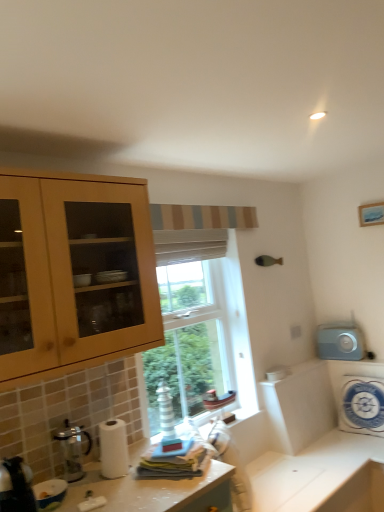
Question: Considering the relative positions of metallic silver kettle at lower left, placed as the 1th appliance when sorted from left to right, and gray matte clock at right, arranged as the third appliance when viewed from the left, in the image provided, is metallic silver kettle at lower left, placed as the 1th appliance when sorted from left to right, to the left of gray matte clock at right, arranged as the third appliance when viewed from the left, from the viewer's perspective?

Choices:
 (A) yes
 (B) no

Answer: (A)

Question: Are metallic silver kettle at lower left, placed as the 1th appliance when sorted from left to right, and gray matte clock at right, arranged as the third appliance when viewed from the left, located far from each other?

Choices:
 (A) no
 (B) yes

Answer: (B)

Question: Is metallic silver kettle at lower left, placed as the 1th appliance when sorted from left to right, shorter than gray matte clock at right, arranged as the third appliance when viewed from the left?

Choices:
 (A) yes
 (B) no

Answer: (A)

Question: Does metallic silver kettle at lower left, which ranks as the 4th appliance in back-to-front order, have a greater width compared to gray matte clock at right, arranged as the 2th appliance when viewed from the right?

Choices:
 (A) yes
 (B) no

Answer: (A)

Question: Does metallic silver kettle at lower left, which is the 4th appliance from right to left, lie behind gray matte clock at right, arranged as the 4th appliance when viewed from the front?

Choices:
 (A) yes
 (B) no

Answer: (B)

Question: Choose the correct answer: Is white glossy bowl at lower left, the 2th appliance from the left, inside white glossy countertop at lower center or outside it?

Choices:
 (A) inside
 (B) outside

Answer: (B)

Question: Considering the relative positions of white glossy bowl at lower left, the 2th appliance from the left, and white glossy countertop at lower center in the image provided, is white glossy bowl at lower left, the 2th appliance from the left, to the left or to the right of white glossy countertop at lower center?

Choices:
 (A) left
 (B) right

Answer: (A)

Question: Looking at their shapes, would you say white glossy bowl at lower left, which is counted as the second appliance, starting from the front, is wider or thinner than white glossy countertop at lower center?

Choices:
 (A) wide
 (B) thin

Answer: (B)

Question: From the image's perspective, is white glossy bowl at lower left, which is counted as the second appliance, starting from the front, above or below white glossy countertop at lower center?

Choices:
 (A) above
 (B) below

Answer: (A)

Question: Looking at the image, does metallic silver coffee maker at lower left seem bigger or smaller compared to white fabric cushion at right, the second appliance when ordered from back to front?

Choices:
 (A) small
 (B) big

Answer: (A)

Question: In terms of height, does metallic silver coffee maker at lower left look taller or shorter compared to white fabric cushion at right, the third appliance positioned from the front?

Choices:
 (A) tall
 (B) short

Answer: (B)

Question: Is metallic silver coffee maker at lower left wider or thinner than white fabric cushion at right, acting as the fourth appliance starting from the left?

Choices:
 (A) thin
 (B) wide

Answer: (A)

Question: Is metallic silver coffee maker at lower left inside or outside of white fabric cushion at right, the third appliance positioned from the front?

Choices:
 (A) inside
 (B) outside

Answer: (B)

Question: Is white glossy countertop at lower center taller or shorter than white fabric cushion at right, the 1th appliance viewed from the right?

Choices:
 (A) short
 (B) tall

Answer: (A)

Question: From a real-world perspective, is white glossy countertop at lower center positioned above or below white fabric cushion at right, acting as the fourth appliance starting from the left?

Choices:
 (A) below
 (B) above

Answer: (A)